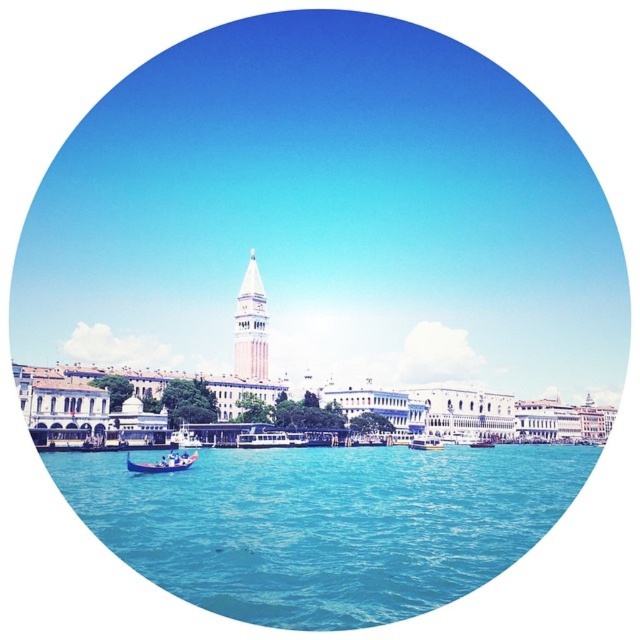
Question: Is blue wooden boat at lower left below wooden gondola at center?

Choices:
 (A) yes
 (B) no

Answer: (B)

Question: From the image, what is the correct spatial relationship of clear blue water at lower center in relation to blue wooden boat at lower left?

Choices:
 (A) right
 (B) left

Answer: (A)

Question: Which point is closer to the camera?

Choices:
 (A) blue wooden boat at lower left
 (B) wooden gondola at center
 (C) clear blue water at lower center
 (D) metallic silver boat at center

Answer: (C)

Question: Among these points, which one is nearest to the camera?

Choices:
 (A) (154, 472)
 (B) (435, 449)
 (C) (234, 339)
 (D) (477, 440)

Answer: (A)

Question: Does clear blue water at lower center appear over wooden gondola at center?

Choices:
 (A) no
 (B) yes

Answer: (B)

Question: Which object is the closest to the wooden gondola at center?

Choices:
 (A) white marble bell tower at center
 (B) blue wooden boat at lower left
 (C) metallic silver boat at center

Answer: (C)